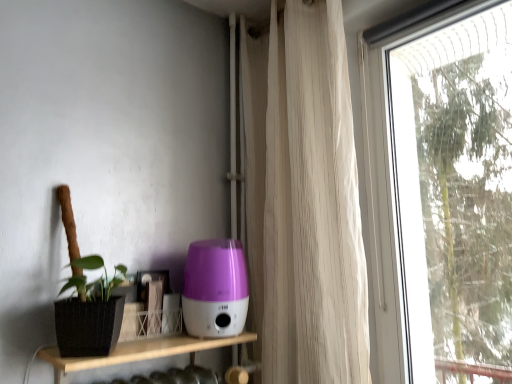
Question: Does transparent glass window at right have a larger size compared to white sheer curtain at right?

Choices:
 (A) no
 (B) yes

Answer: (A)

Question: From the image's perspective, is transparent glass window at right beneath white sheer curtain at right?

Choices:
 (A) yes
 (B) no

Answer: (A)

Question: Are transparent glass window at right and white sheer curtain at right located far from each other?

Choices:
 (A) no
 (B) yes

Answer: (B)

Question: Is transparent glass window at right aimed at white sheer curtain at right?

Choices:
 (A) yes
 (B) no

Answer: (B)

Question: From the image's perspective, is transparent glass window at right located above white sheer curtain at right?

Choices:
 (A) no
 (B) yes

Answer: (A)

Question: In the image, is white sheer curtain at right on the left side or the right side of transparent glass window at right?

Choices:
 (A) right
 (B) left

Answer: (B)

Question: From the image's perspective, is white sheer curtain at right above or below transparent glass window at right?

Choices:
 (A) above
 (B) below

Answer: (A)

Question: Does point [x=334, y=266] appear closer or farther from the camera than point [x=455, y=157]?

Choices:
 (A) farther
 (B) closer

Answer: (B)

Question: From a real-world perspective, is white sheer curtain at right positioned above or below transparent glass window at right?

Choices:
 (A) below
 (B) above

Answer: (B)

Question: From the image's perspective, relative to transparent glass window at right, is purple plastic humidifier at center above or below?

Choices:
 (A) below
 (B) above

Answer: (A)

Question: Visually, is purple plastic humidifier at center positioned to the left or to the right of transparent glass window at right?

Choices:
 (A) right
 (B) left

Answer: (B)

Question: Would you say purple plastic humidifier at center is inside or outside transparent glass window at right?

Choices:
 (A) inside
 (B) outside

Answer: (B)

Question: Considering their positions, is purple plastic humidifier at center located in front of or behind transparent glass window at right?

Choices:
 (A) front
 (B) behind

Answer: (B)

Question: From the image's perspective, is transparent glass window at right located above or below purple plastic humidifier at center?

Choices:
 (A) above
 (B) below

Answer: (A)

Question: Considering the positions of transparent glass window at right and purple plastic humidifier at center in the image, is transparent glass window at right bigger or smaller than purple plastic humidifier at center?

Choices:
 (A) big
 (B) small

Answer: (A)